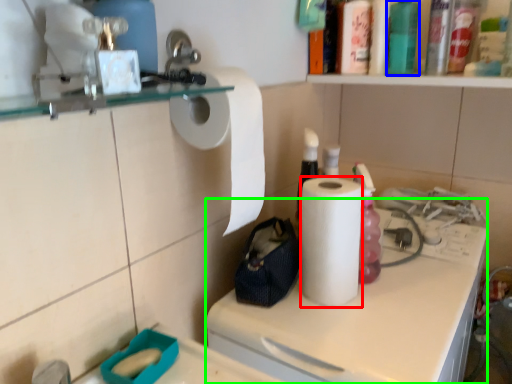
Question: Estimate the real-world distances between objects in this image. Which object is closer to paper towel (highlighted by a red box), bottle (highlighted by a blue box) or counter (highlighted by a green box)?

Choices:
 (A) bottle
 (B) counter

Answer: (B)